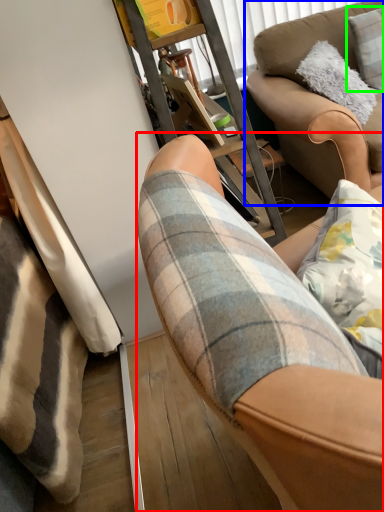
Question: Considering the real-world distances, which object is closest to chair (highlighted by a red box)? studio couch (highlighted by a blue box) or pillow (highlighted by a green box).

Choices:
 (A) studio couch
 (B) pillow

Answer: (A)